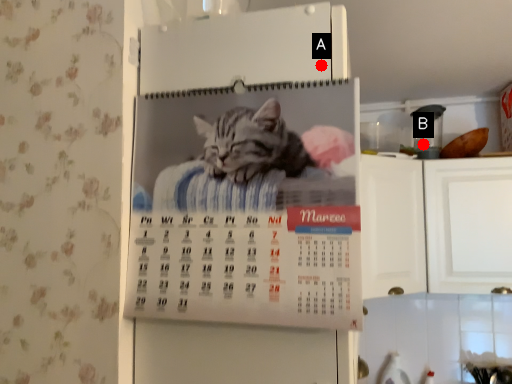
Question: Two points are circled on the image, labeled by A and B beside each circle. Among these points, which one is farthest from the camera?

Choices:
 (A) A is further
 (B) B is further

Answer: (B)